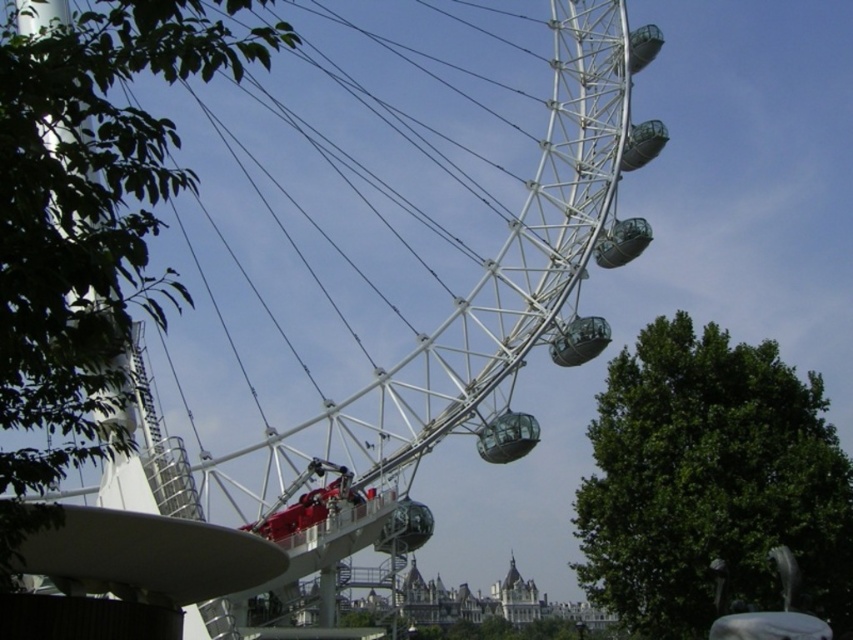
Looking at this image, you are standing at the base of the Ferris wheel and looking up at the white metallic ferris wheel at center. There is a point marked at coordinates point (299, 230). Where is this point located?

The point (299, 230) is on the white metallic ferris wheel at center.

You are standing in front of the Ferris wheel and notice two green leafy trees. One is labeled as the green leafy tree at left and the other as the green leafy tree at right. Which tree is closer to you?

The green leafy tree at left is closer to you because it is positioned in front of the green leafy tree at right.

You are standing in a park and want to take a photo of the white metallic ferris wheel at center and the green leafy tree at left. Which object should you focus on first to ensure it appears sharp in your photo?

You should focus on the white metallic ferris wheel at center first because it is closer to you than the green leafy tree at left, so focusing on it will keep it sharp while the tree may appear slightly blurred.